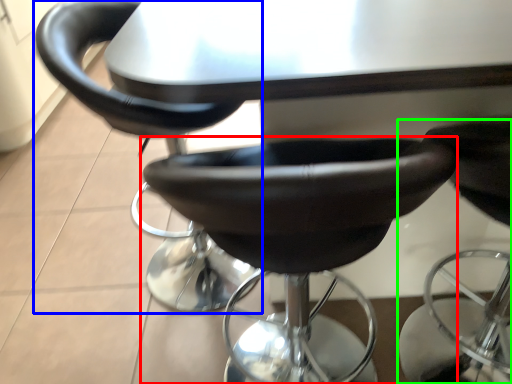
Question: Estimate the real-world distances between objects in this image. Which object is closer to chair (highlighted by a red box), chair (highlighted by a blue box) or chair (highlighted by a green box)?

Choices:
 (A) chair
 (B) chair

Answer: (A)